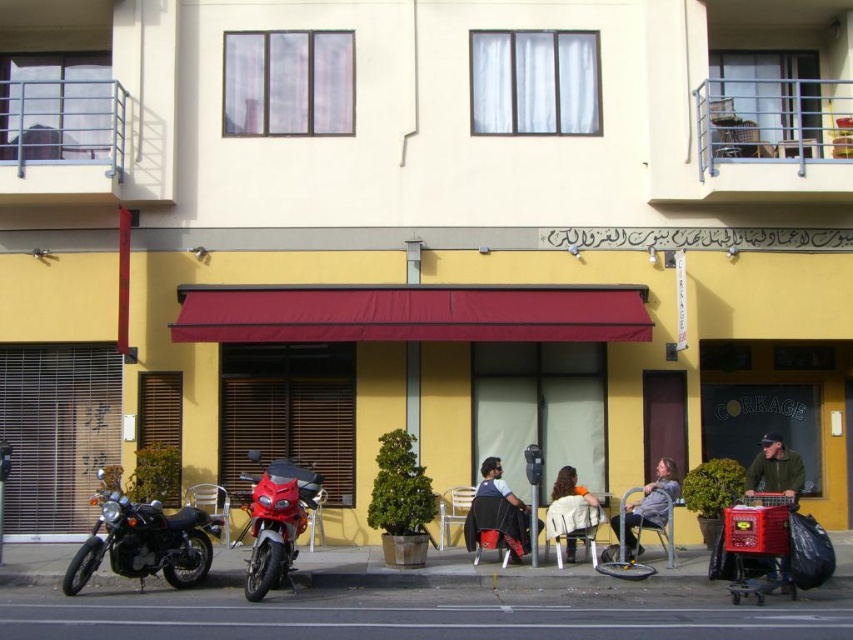
You are a delivery person who needs to place a package on the gray fabric jacket at lower right. Your delivery cart is parked 15 feet away from the black matte motorcycle at lower left. Can you reach the jacket without moving the cart?

The distance between the black matte motorcycle at lower left and the gray fabric jacket at lower right is 19.12 feet. Since your cart is parked 15 feet away from the motorcycle, you are still 4.12 feet away from the jacket. Therefore, you cannot reach the jacket without moving the cart.

You are a delivery person who needs to park your scooter between the two motorcycles at lower left. Which motorcycle should you place your scooter next to so it doesn not block the entrance? The black matte motorcycle at lower left is positioned under shiny red motorcycle at lower left.

The black matte motorcycle at lower left is positioned under the shiny red motorcycle at lower left, so placing your scooter next to the shiny red motorcycle at lower left would avoid blocking the entrance.